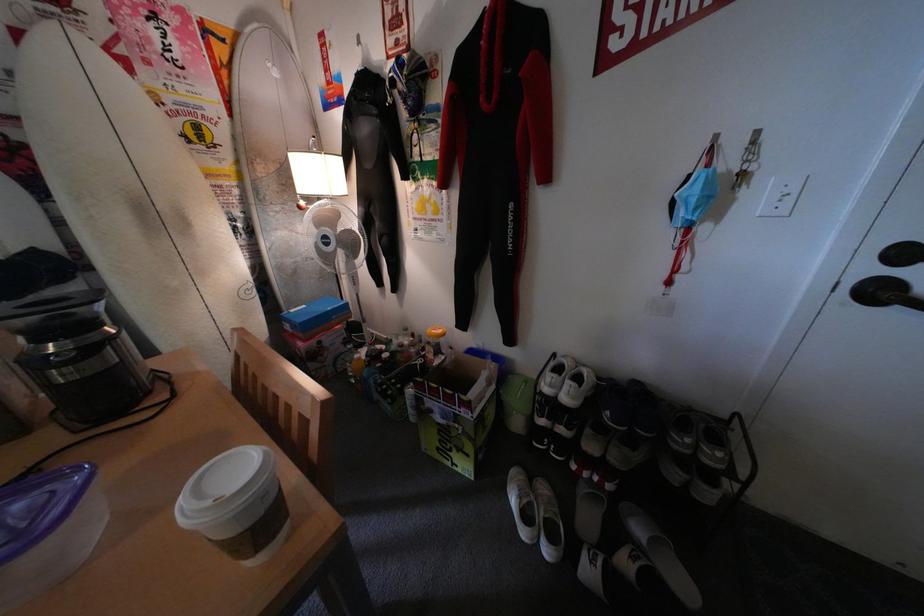
This screenshot has width=924, height=616. Find the location of `green plastic bottle`. green plastic bottle is located at coordinates (517, 402).